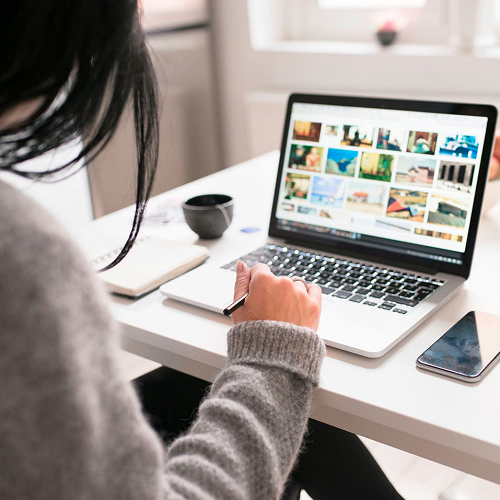
Where is `floor`? The width and height of the screenshot is (500, 500). floor is located at coordinates (401, 479).